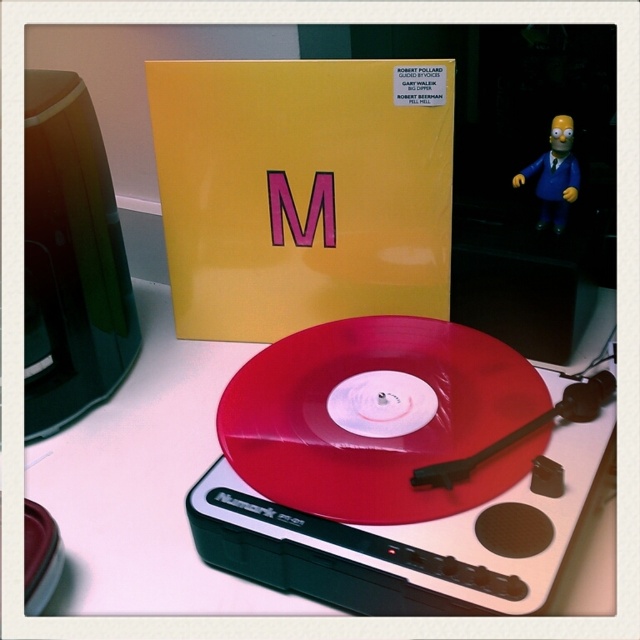
You are setting up a display on a shelf and want to place both the white plastic turntable at center and the blue plastic homer simpson figurine at upper right. Since you have limited space, which object should you place first to ensure both fit?

You should place the blue plastic homer simpson figurine at upper right first because it is smaller than the white plastic turntable at center, allowing more space for the larger item afterward.

Consider the image. You are setting up a DJ booth and need to place the blue plastic homer simpson figurine at upper right behind the white plastic turntable at center so it doesn t block the controls. Can you do this based on the current setup?

The white plastic turntable at center is already in front of the blue plastic homer simpson figurine at upper right, so yes, the current setup already has the blue plastic homer simpson figurine at upper right placed behind the white plastic turntable at center and won t block the controls.